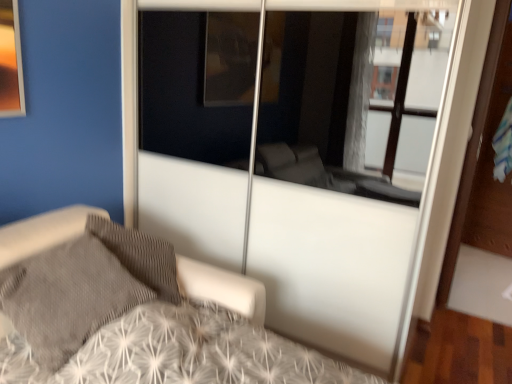
Question: Is point (28, 306) positioned closer to the camera than point (97, 238)?

Choices:
 (A) farther
 (B) closer

Answer: (B)

Question: Considering the positions of white textured bed at center and gray textured pillow at lower left in the image, is white textured bed at center wider or thinner than gray textured pillow at lower left?

Choices:
 (A) thin
 (B) wide

Answer: (B)

Question: From a real-world perspective, is white textured bed at center physically located above or below gray textured pillow at lower left?

Choices:
 (A) below
 (B) above

Answer: (A)

Question: Is point (83, 306) closer or farther from the camera than point (78, 251)?

Choices:
 (A) closer
 (B) farther

Answer: (A)

Question: Is gray textured pillow at lower left bigger or smaller than white textured bed at center?

Choices:
 (A) small
 (B) big

Answer: (A)

Question: Would you say gray textured pillow at lower left is inside or outside white textured bed at center?

Choices:
 (A) outside
 (B) inside

Answer: (B)

Question: From their relative heights in the image, would you say gray textured pillow at lower left is taller or shorter than white textured bed at center?

Choices:
 (A) tall
 (B) short

Answer: (B)